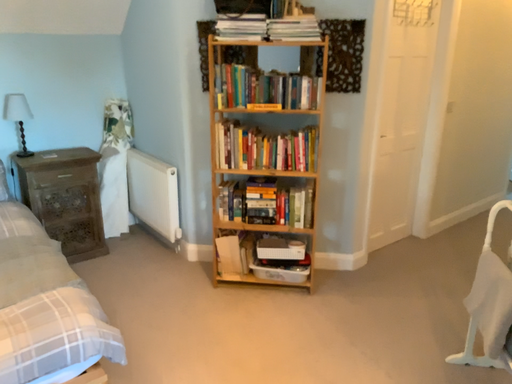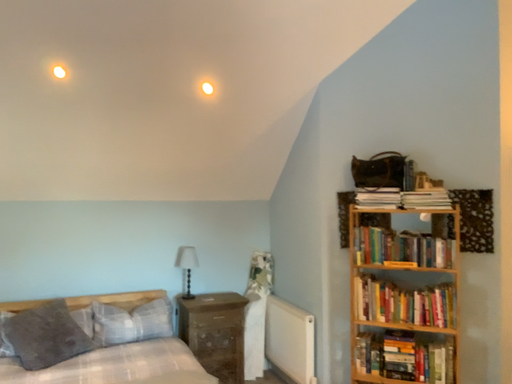
Question: Which way did the camera rotate in the video?

Choices:
 (A) rotated left
 (B) rotated right

Answer: (A)